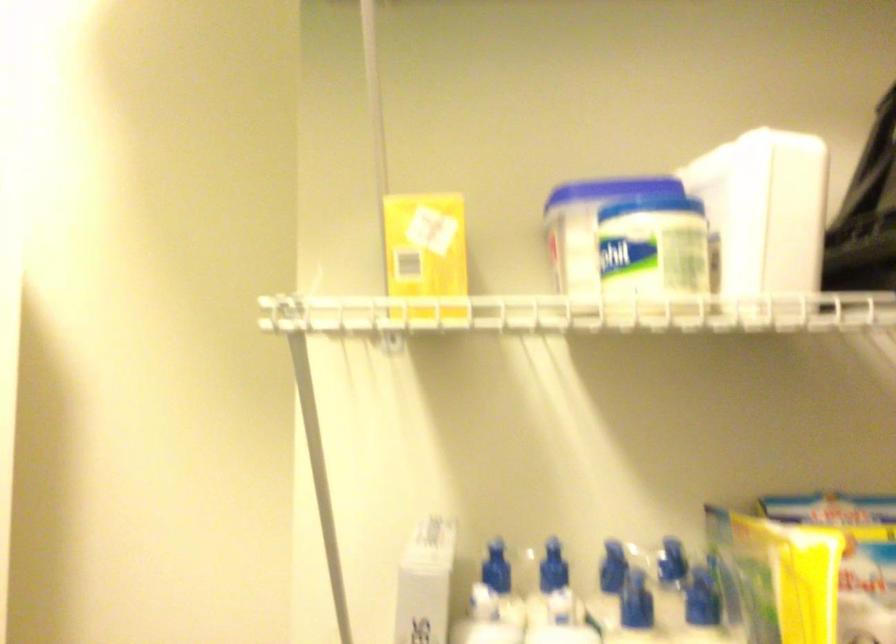
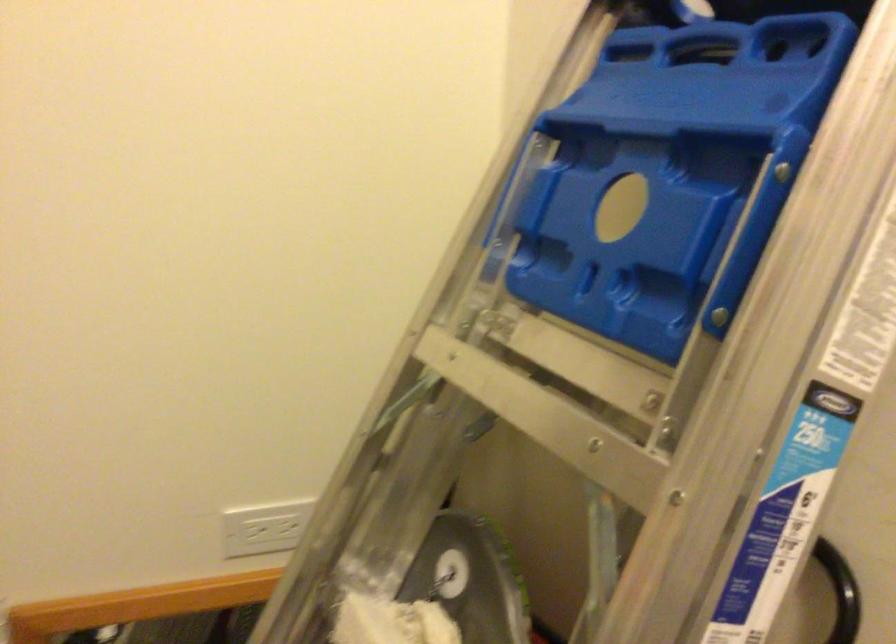
Question: The first image is from the beginning of the video and the second image is from the end. How did the camera likely rotate when shooting the video?

Choices:
 (A) Left
 (B) Right
 (C) Up
 (D) Down

Answer: (B)